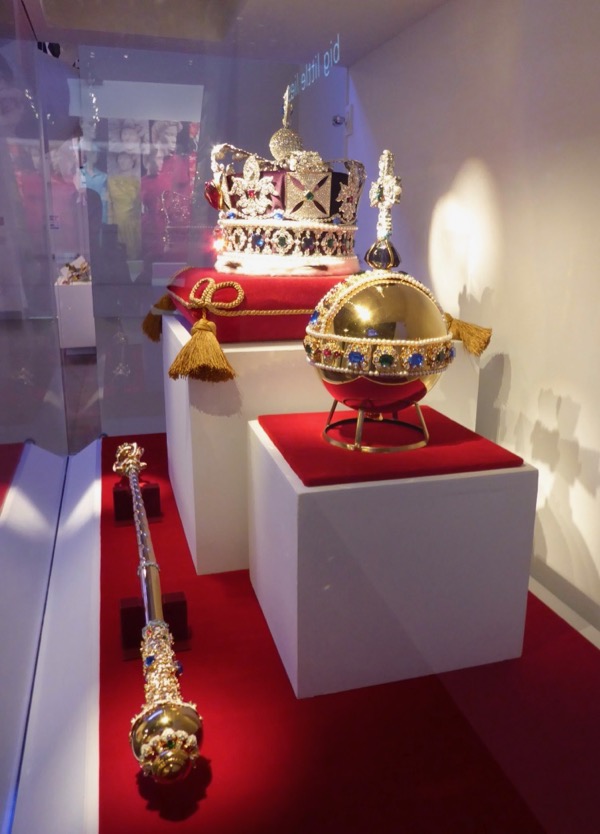
Where is `gold cord trim`? The width and height of the screenshot is (600, 834). gold cord trim is located at coordinates (236, 303).